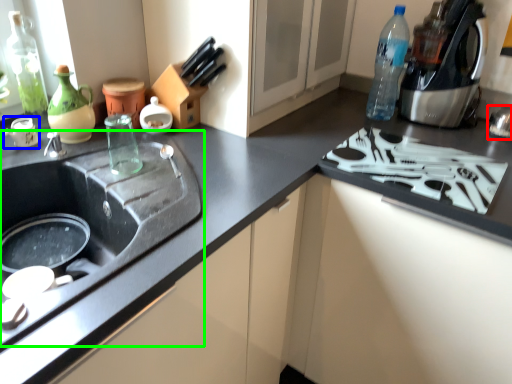
Question: Based on their relative distances, which object is farther from appliance (highlighted by a red box)? Choose from appliance (highlighted by a blue box) and sink (highlighted by a green box).

Choices:
 (A) appliance
 (B) sink

Answer: (A)